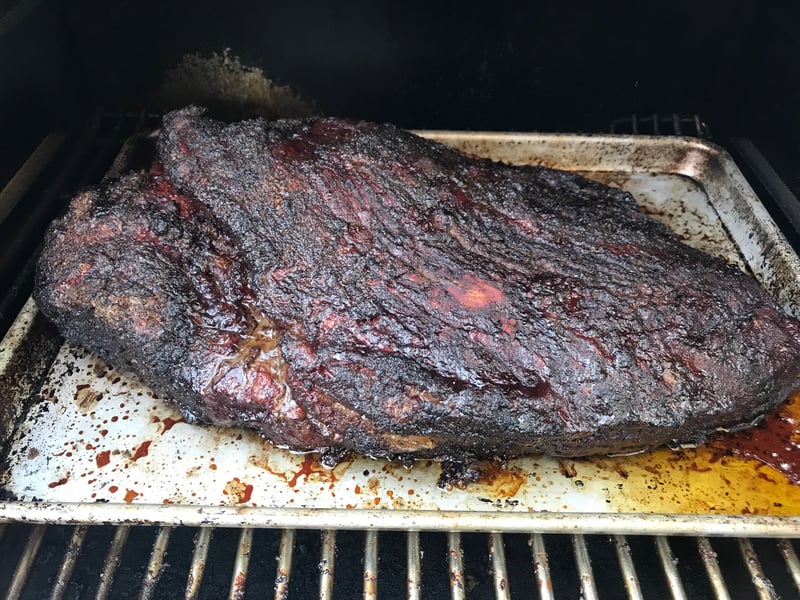
Locate an element on the screen. This screenshot has height=600, width=800. baking tray is located at coordinates (294, 491).